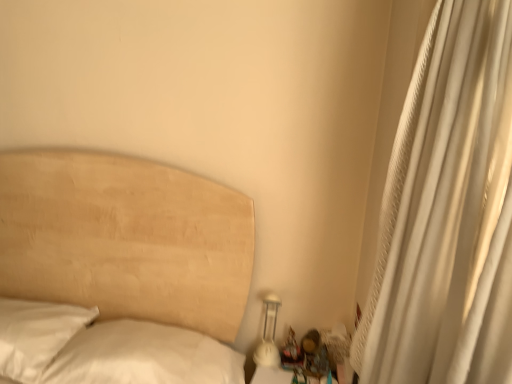
Question: From a real-world perspective, does wooden figurine at lower right stand above white textured curtain at right?

Choices:
 (A) yes
 (B) no

Answer: (B)

Question: Is wooden figurine at lower right aimed at white textured curtain at right?

Choices:
 (A) yes
 (B) no

Answer: (B)

Question: Is wooden figurine at lower right closer to the viewer compared to white textured curtain at right?

Choices:
 (A) no
 (B) yes

Answer: (A)

Question: Is wooden figurine at lower right bigger than white textured curtain at right?

Choices:
 (A) no
 (B) yes

Answer: (A)

Question: From the image's perspective, is wooden figurine at lower right beneath white textured curtain at right?

Choices:
 (A) no
 (B) yes

Answer: (B)

Question: Can you confirm if wooden figurine at lower right is wider than white textured curtain at right?

Choices:
 (A) no
 (B) yes

Answer: (A)

Question: Considering the relative positions of white textured curtain at right and white glossy bedside lamp at lower right in the image provided, is white textured curtain at right behind white glossy bedside lamp at lower right?

Choices:
 (A) yes
 (B) no

Answer: (B)

Question: Is white textured curtain at right not within white glossy bedside lamp at lower right?

Choices:
 (A) yes
 (B) no

Answer: (A)

Question: Would you consider white textured curtain at right to be distant from white glossy bedside lamp at lower right?

Choices:
 (A) no
 (B) yes

Answer: (A)

Question: Can you confirm if white textured curtain at right is positioned to the left of white glossy bedside lamp at lower right?

Choices:
 (A) no
 (B) yes

Answer: (A)

Question: Are white textured curtain at right and white glossy bedside lamp at lower right beside each other?

Choices:
 (A) no
 (B) yes

Answer: (A)

Question: From a real-world perspective, is white textured curtain at right positioned under white glossy bedside lamp at lower right based on gravity?

Choices:
 (A) no
 (B) yes

Answer: (A)

Question: From a real-world perspective, is white glossy bedside lamp at lower right over white textured curtain at right?

Choices:
 (A) no
 (B) yes

Answer: (A)